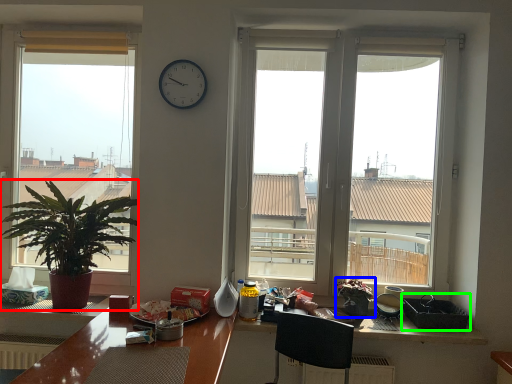
Question: Which object is positioned closest to houseplant (highlighted by a red box)? Select from houseplant (highlighted by a blue box) and picnic basket (highlighted by a green box).

Choices:
 (A) houseplant
 (B) picnic basket

Answer: (A)